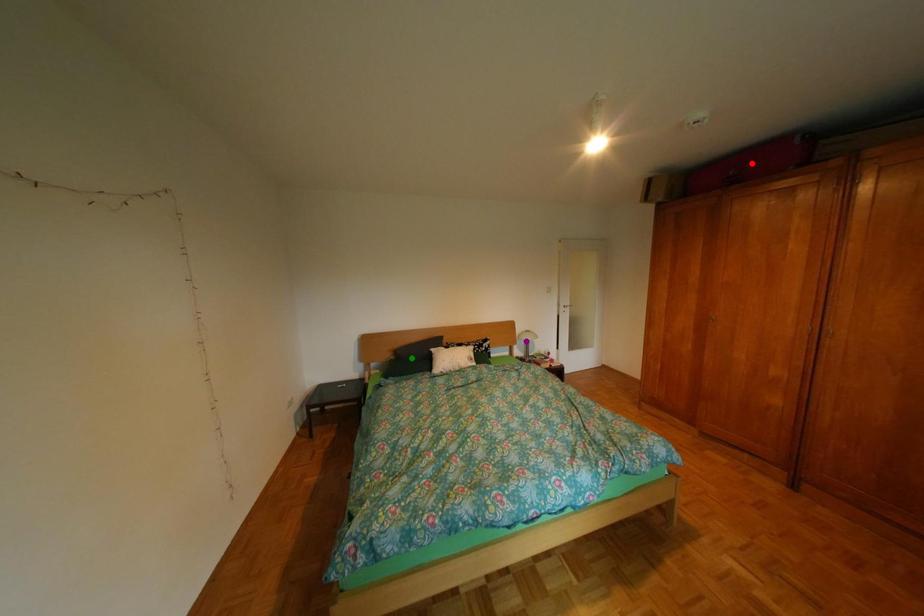
Order these from nearest to farthest:
A) purple point
B) green point
C) red point

red point < green point < purple point